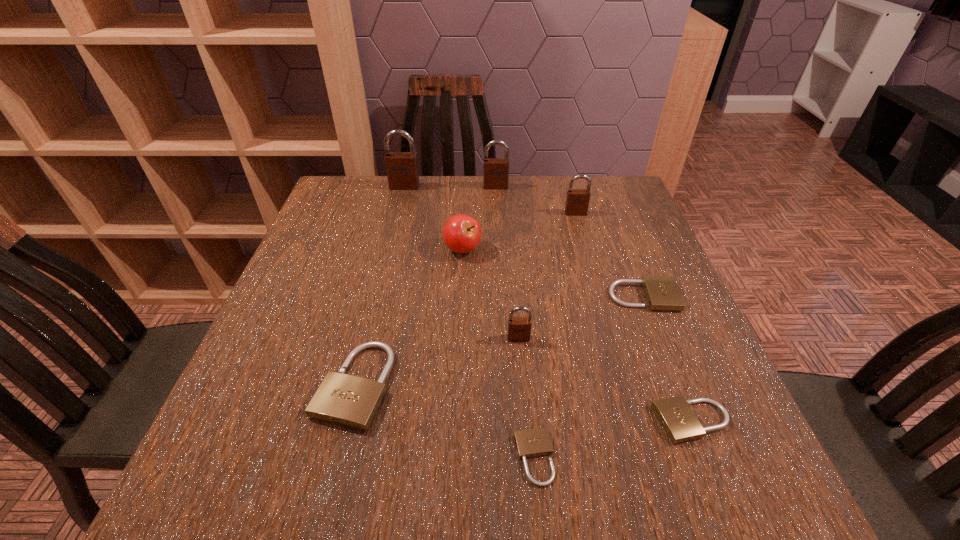
This screenshot has width=960, height=540. Identify the location of the fourth shortest padlock. (349, 401).

Identify the location of the sixth tallest object. The width and height of the screenshot is (960, 540). (349, 401).

Identify the location of the fifth nearest object. The image size is (960, 540). (662, 292).

Where is `the farthest beige padlock`? the farthest beige padlock is located at coordinates (662, 292).

The image size is (960, 540). Find the location of `the second shortest object`. the second shortest object is located at coordinates (676, 416).

Identify the location of the second smallest beige padlock. (676, 416).

You are a GUI agent. You are given a task and a screenshot of the screen. Output one action in this format:
    pyautogui.click(x=<x>, y=<y>)
    Task: Click on the third beige padlock from right to left
    
    Given the screenshot: What is the action you would take?
    pyautogui.click(x=535, y=442)

Identify the location of the shortest padlock. (535, 442).

You are a GUI agent. You are given a task and a screenshot of the screen. Output one action in this format:
    pyautogui.click(x=<x>, y=<y>)
    Task: Click on the vacant space located 0.380m on the front-facing side of the tallest object
    
    Given the screenshot: What is the action you would take?
    pyautogui.click(x=383, y=274)

This screenshot has height=540, width=960. I want to click on free space located 0.390m on the front-facing side of the second tallest padlock, so click(500, 276).